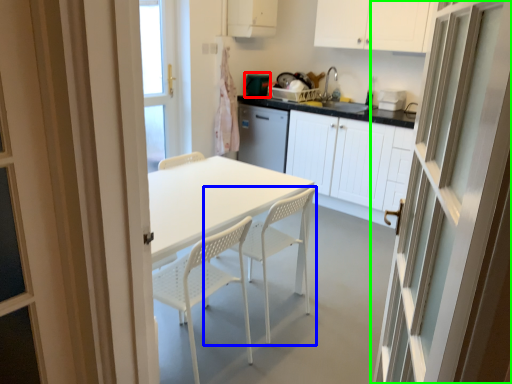
Question: Estimate the real-world distances between objects in this image. Which object is closer to appliance (highlighted by a red box), chair (highlighted by a blue box) or door (highlighted by a green box)?

Choices:
 (A) chair
 (B) door

Answer: (A)